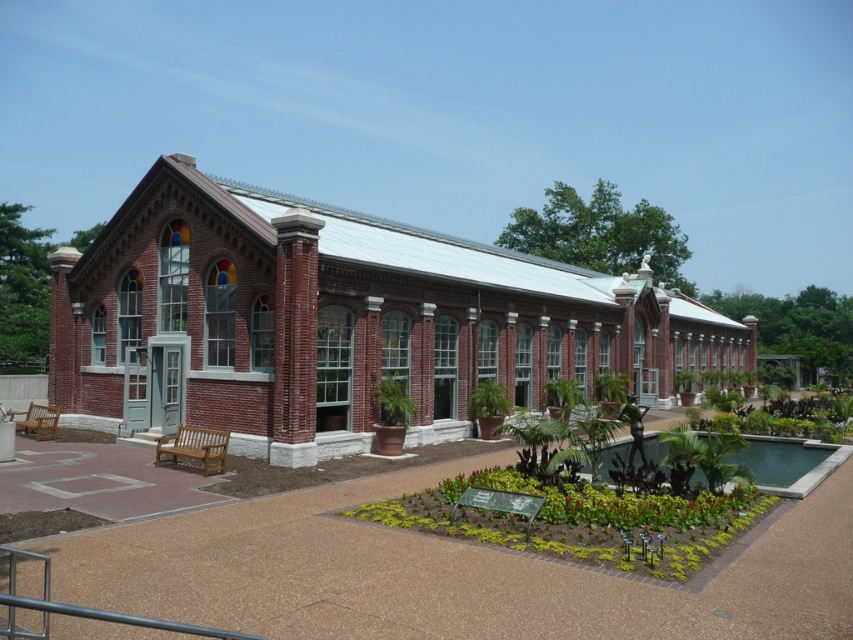
Who is positioned more to the left, lush greenery at center or green concrete pool at center?

lush greenery at center

Between point (621, 538) and point (604, 461), which one is positioned in front?

Point (621, 538) is more forward.

Where is `lush greenery at center`? Image resolution: width=853 pixels, height=640 pixels. lush greenery at center is located at coordinates (582, 520).

Which of these two, red brick chapel at center or lush greenery at center, stands shorter?

Standing shorter between the two is lush greenery at center.

Can you confirm if red brick chapel at center is positioned above lush greenery at center?

Indeed, red brick chapel at center is positioned over lush greenery at center.

Who is more distant from viewer, (144, 276) or (573, 538)?

Point (144, 276)

Locate an element on the screen. The image size is (853, 640). red brick chapel at center is located at coordinates (338, 323).

Which is above, red brick chapel at center or green concrete pool at center?

red brick chapel at center is above.

Between point (442, 269) and point (822, 445), which one is positioned in front?

Point (442, 269)

The image size is (853, 640). I want to click on red brick chapel at center, so click(x=338, y=323).